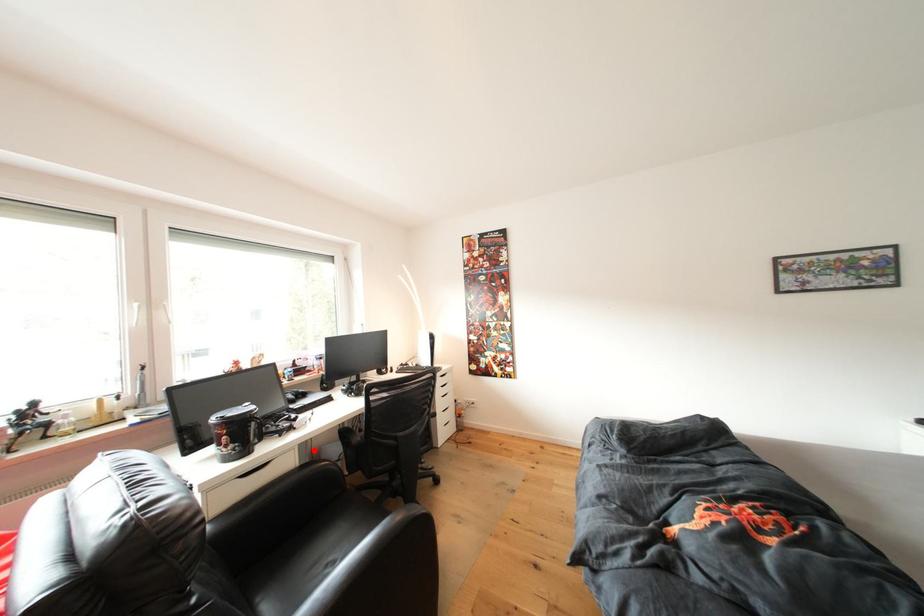
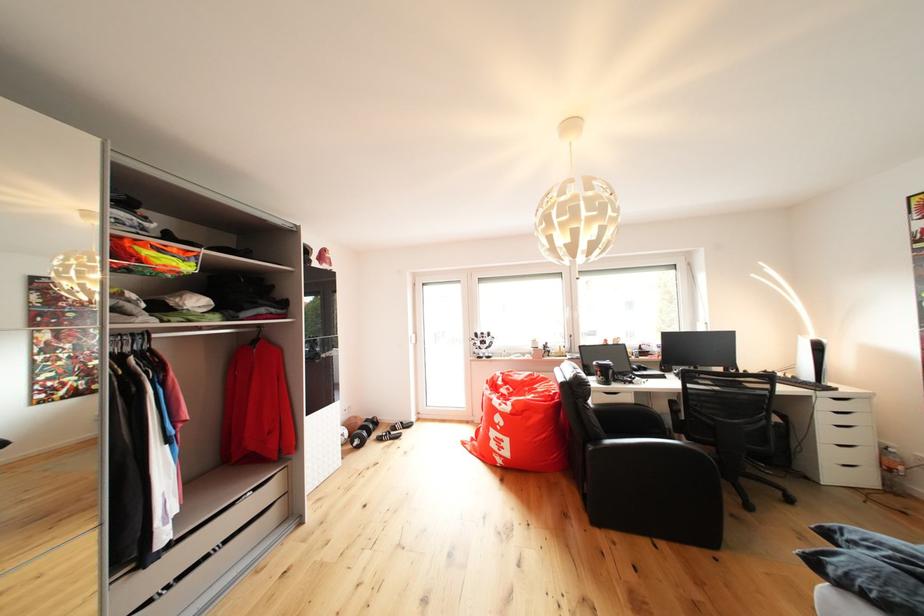
Question: A red point is marked in image1. In image2, is the corresponding 3D point closer to the camera or farther? Reply with the corresponding letter.

Choices:
 (A) The corresponding 3D point is closer.
 (B) The corresponding 3D point is farther.

Answer: (B)